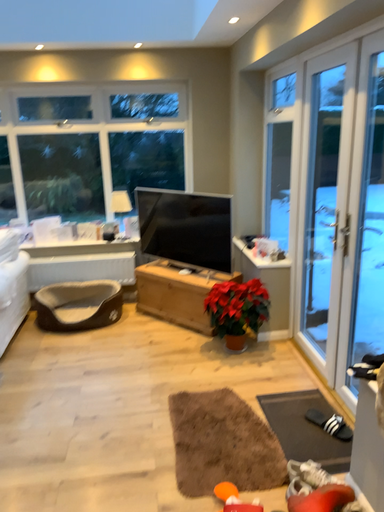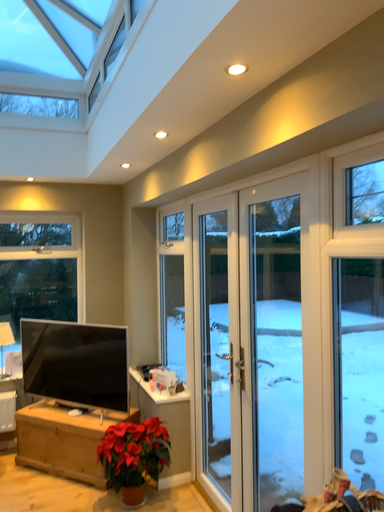
Question: Which way did the camera rotate in the video?

Choices:
 (A) rotated right
 (B) rotated left

Answer: (A)